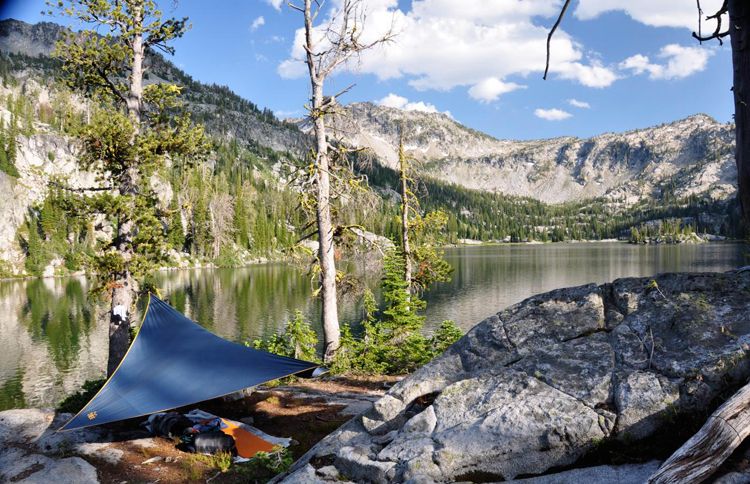
You are a GUI agent. You are given a task and a screenshot of the screen. Output one action in this format:
    pyautogui.click(x=<x>, y=<y>)
    Task: Click on the orange blanket
    This screenshot has width=750, height=484.
    Given the screenshot: What is the action you would take?
    pyautogui.click(x=250, y=442)